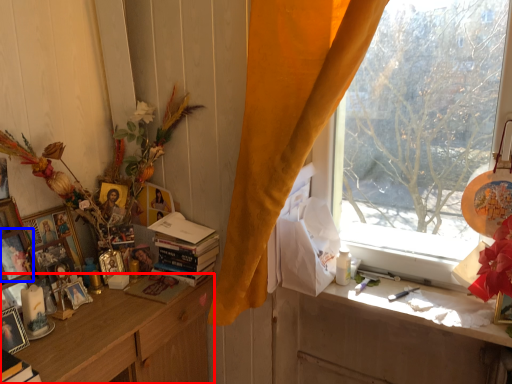
Question: Among these objects, which one is farthest to the camera, cabinetry (highlighted by a red box) or picture frame (highlighted by a blue box)?

Choices:
 (A) cabinetry
 (B) picture frame

Answer: (B)